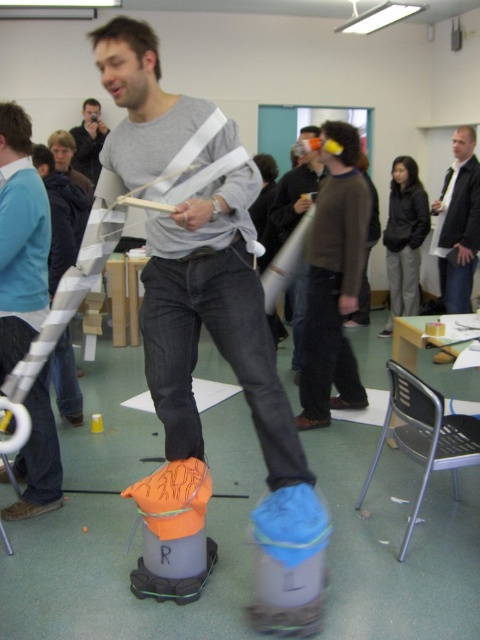
You are standing in the classroom and need to locate the matte gray sweater at upper center. According to the coordinates provided, where exactly should you look?

The matte gray sweater at upper center is located at point coordinates of 0.375 on the x axis and 0.044 on the y axis.

You are an observer in the classroom and notice the matte gray sweater at upper center and the matte orange helmet at upper center. Which object is positioned closer to you?

The matte gray sweater at upper center is closer to the viewer than the matte orange helmet at upper center.

You are a participant in the activity and need to reach an object placed on top of the taller item between the orange fabric bag at center and the matte orange helmet at upper center. Which object should you target?

The orange fabric bag at center is much taller than the matte orange helmet at upper center, so you should target the orange fabric bag at center to reach the object placed on top.